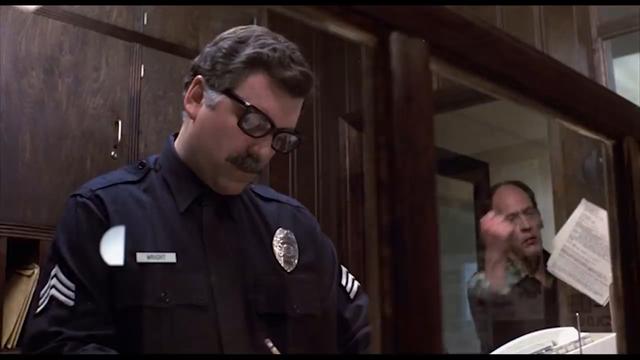
I want to click on papers, so (598, 250).